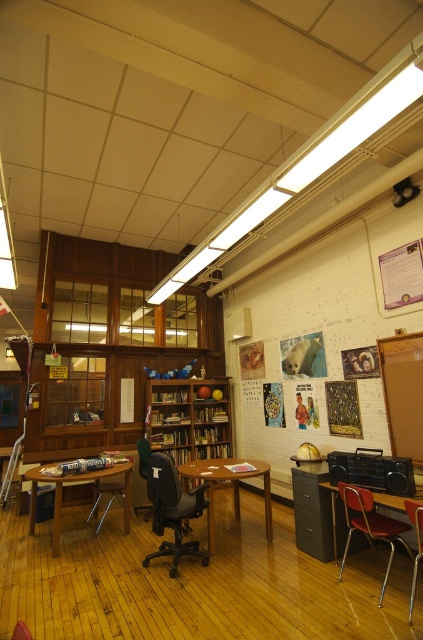
Does brown cardboard at right have a larger size compared to green fabric office chair at center?

Yes.

Who is higher up, brown cardboard at right or green fabric office chair at center?

brown cardboard at right is higher up.

Locate an element on the screen. brown cardboard at right is located at coordinates point(403,392).

Locate an element on the screen. The width and height of the screenshot is (423, 640). brown cardboard at right is located at coordinates (403, 392).

Can you confirm if brown wooden table at center is smaller than green fabric office chair at center?

Actually, brown wooden table at center might be larger than green fabric office chair at center.

Is brown wooden table at center above green fabric office chair at center?

Indeed, brown wooden table at center is positioned over green fabric office chair at center.

Does point (266, 528) lie in front of point (145, 516)?

Yes, it is.

In order to click on brown wooden table at center in this screenshot , I will do `click(227, 484)`.

Is wooden table at lower left wider than metallic at right?

Yes, wooden table at lower left is wider than metallic at right.

The image size is (423, 640). I want to click on wooden table at lower left, so click(76, 483).

At what (x,y) coordinates should I click in order to perform the action: click on wooden table at lower left. Please return your answer as a coordinate pair (x, y). Image resolution: width=423 pixels, height=640 pixels. Looking at the image, I should click on (76, 483).